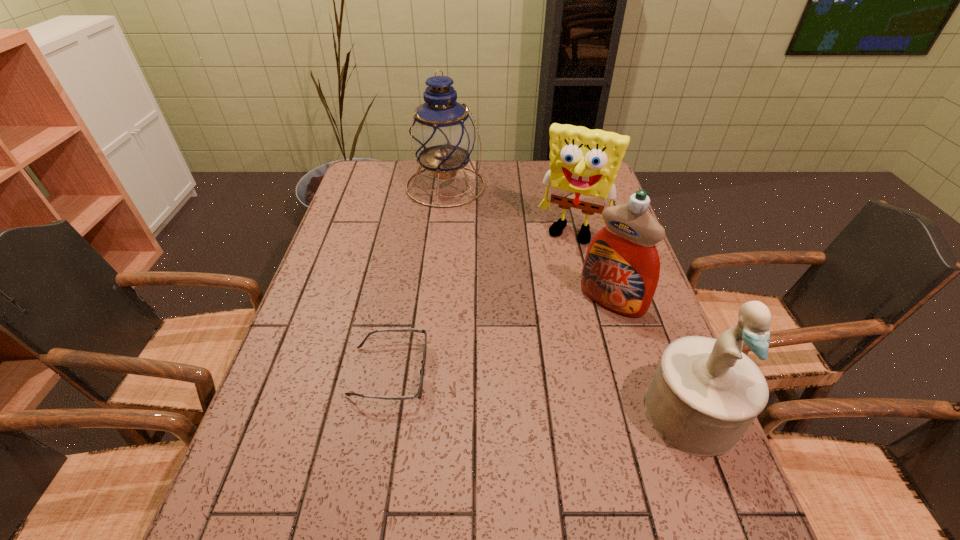
Find the location of a particular element. This screenshot has height=540, width=960. sunglasses is located at coordinates (419, 393).

You are a GUI agent. You are given a task and a screenshot of the screen. Output one action in this format:
    pyautogui.click(x=<x>, y=<y>)
    Task: Click on the figurine
    This screenshot has width=960, height=540.
    Given the screenshot: What is the action you would take?
    pyautogui.click(x=705, y=394)

At what (x,y) coordinates should I click in order to perform the action: click on the fourth nearest object. Please return your answer as a coordinate pair (x, y). This screenshot has height=540, width=960. Looking at the image, I should click on (584, 163).

Where is `the tallest object`? This screenshot has width=960, height=540. the tallest object is located at coordinates (442, 136).

Locate an element on the screen. Image resolution: width=960 pixels, height=540 pixels. the farthest object is located at coordinates (442, 136).

The width and height of the screenshot is (960, 540). Find the location of `the third nearest object`. the third nearest object is located at coordinates (621, 269).

Where is `free region located 0.180m on the front-facing side of the shortest object`? Image resolution: width=960 pixels, height=540 pixels. free region located 0.180m on the front-facing side of the shortest object is located at coordinates (507, 372).

Find the location of a particular element. This screenshot has height=540, width=960. free point located 0.290m on the face of the fourth nearest object is located at coordinates (531, 310).

Find the location of a particular element. The width and height of the screenshot is (960, 540). vacant space situated on the face of the fourth nearest object is located at coordinates (517, 339).

This screenshot has width=960, height=540. Find the location of `vacant area situated 0.390m on the face of the fourth nearest object`. vacant area situated 0.390m on the face of the fourth nearest object is located at coordinates (517, 339).